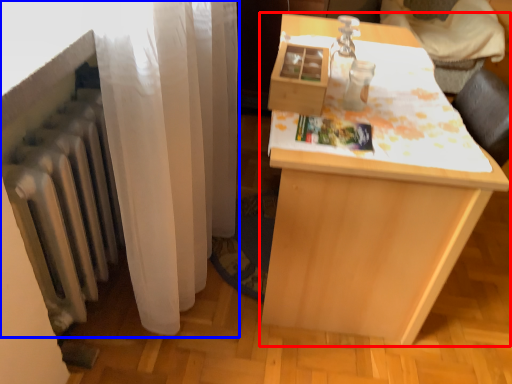
Question: Among these objects, which one is nearest to the camera, table (highlighted by a red box) or curtain (highlighted by a blue box)?

Choices:
 (A) table
 (B) curtain

Answer: (B)